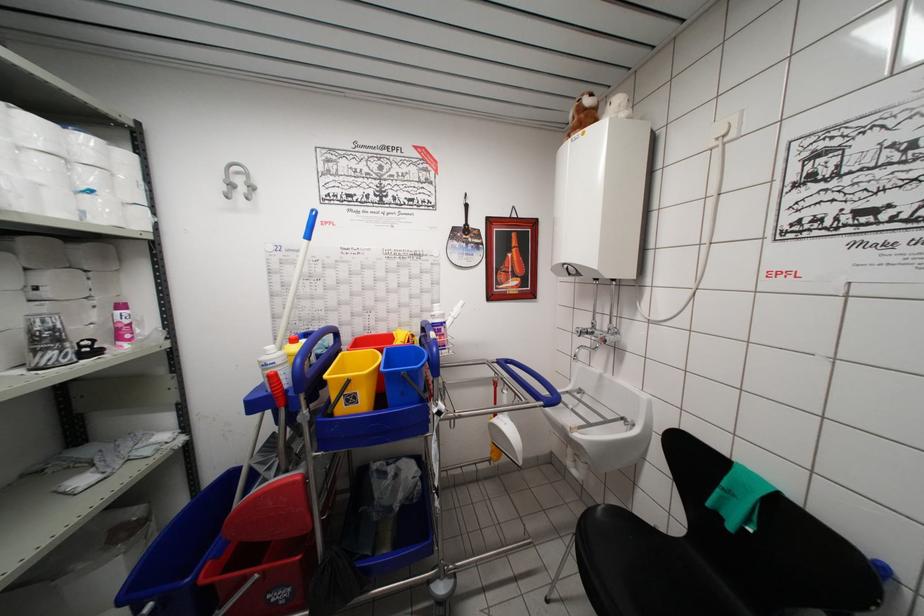
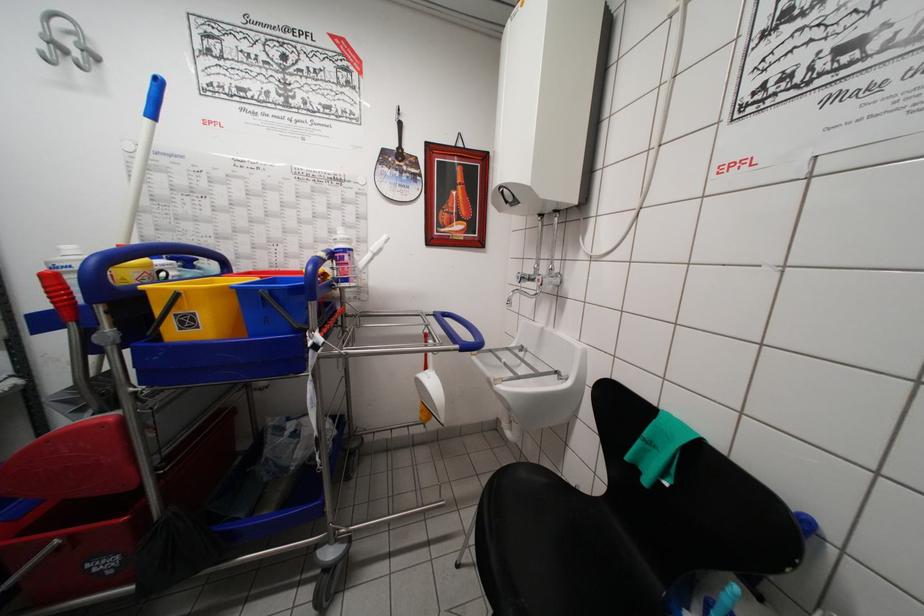
In the second image, find the point that corresponds to (x=573, y=278) in the first image.

(511, 207)